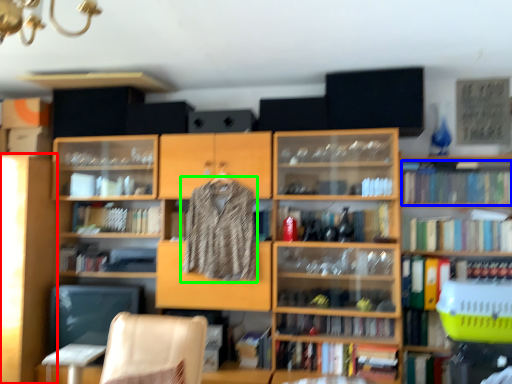
Question: Based on their relative distances, which object is farther from shelf (highlighted by a red box)? Choose from book (highlighted by a blue box) and clothing (highlighted by a green box).

Choices:
 (A) book
 (B) clothing

Answer: (A)